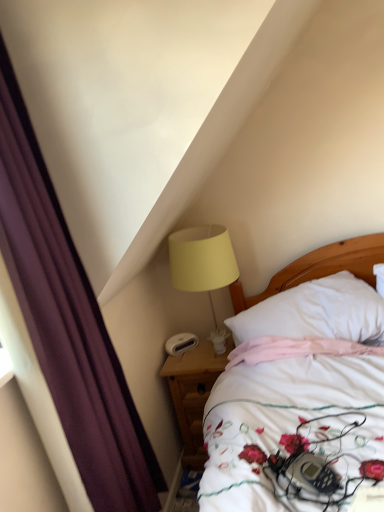
Question: Is purple fabric curtain at left to the left or to the right of white soft pillow at center in the image?

Choices:
 (A) left
 (B) right

Answer: (A)

Question: Considering the positions of point (99, 395) and point (292, 332), is point (99, 395) closer or farther from the camera than point (292, 332)?

Choices:
 (A) closer
 (B) farther

Answer: (A)

Question: Which of these objects is positioned closest to the white plastic alarm clock at lower center?

Choices:
 (A) yellow fabric lampshade at upper right
 (B) purple fabric curtain at left
 (C) white soft pillow at center
 (D) wooden nightstand at lower center

Answer: (D)

Question: Which object is the farthest from the white plastic alarm clock at lower center?

Choices:
 (A) wooden nightstand at lower center
 (B) purple fabric curtain at left
 (C) yellow fabric lampshade at upper right
 (D) white soft pillow at center

Answer: (B)